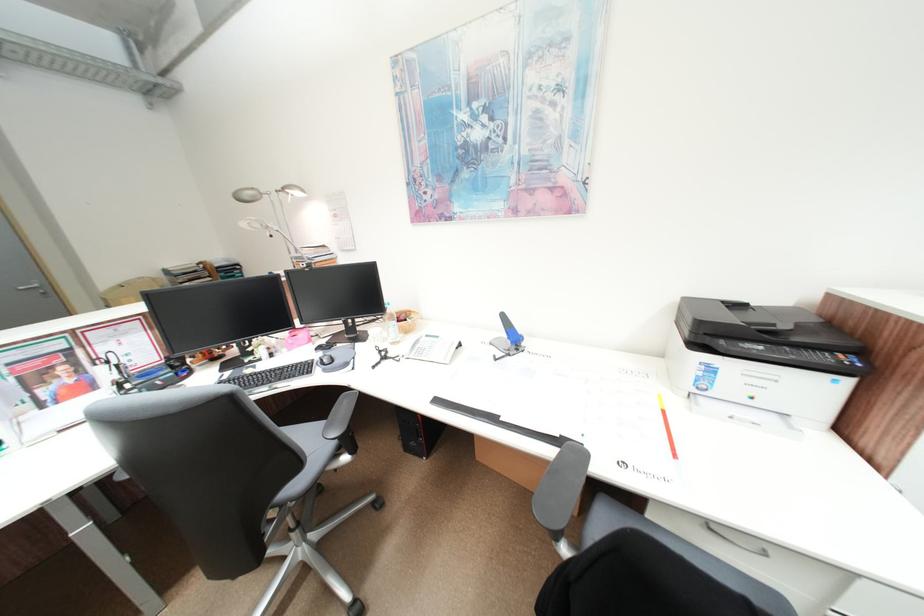
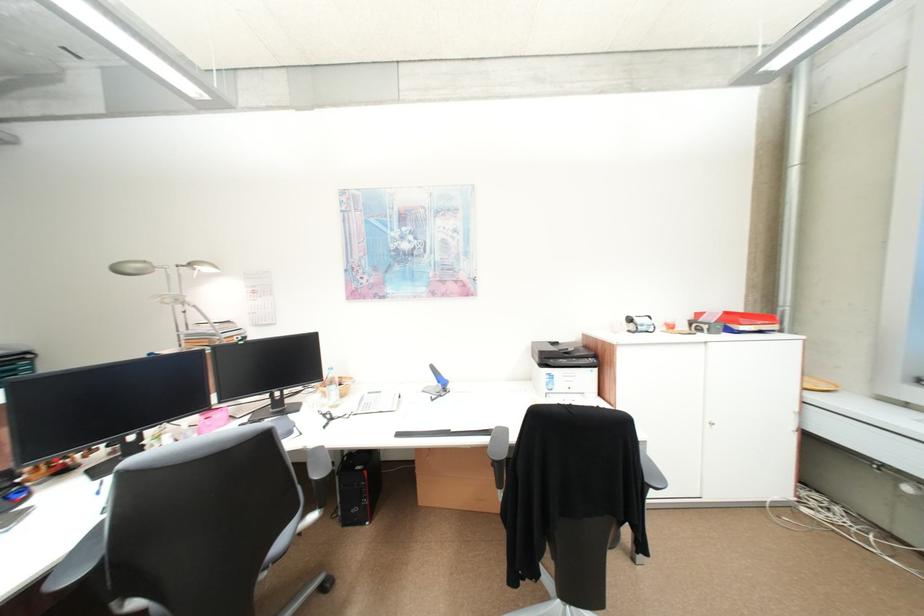
Based on the continuous images, in which direction is the camera rotating?

The camera's rotation is toward right-up.